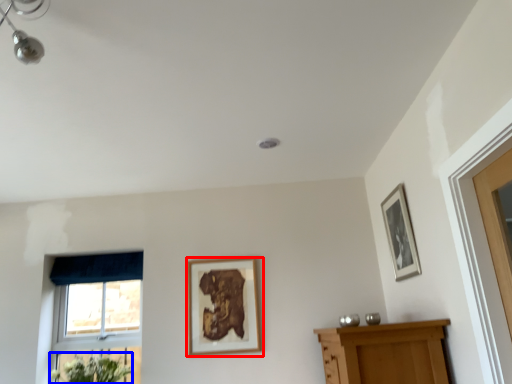
Question: Which point is closer to the camera, picture frame (highlighted by a red box) or flower (highlighted by a blue box)?

Choices:
 (A) picture frame
 (B) flower

Answer: (B)